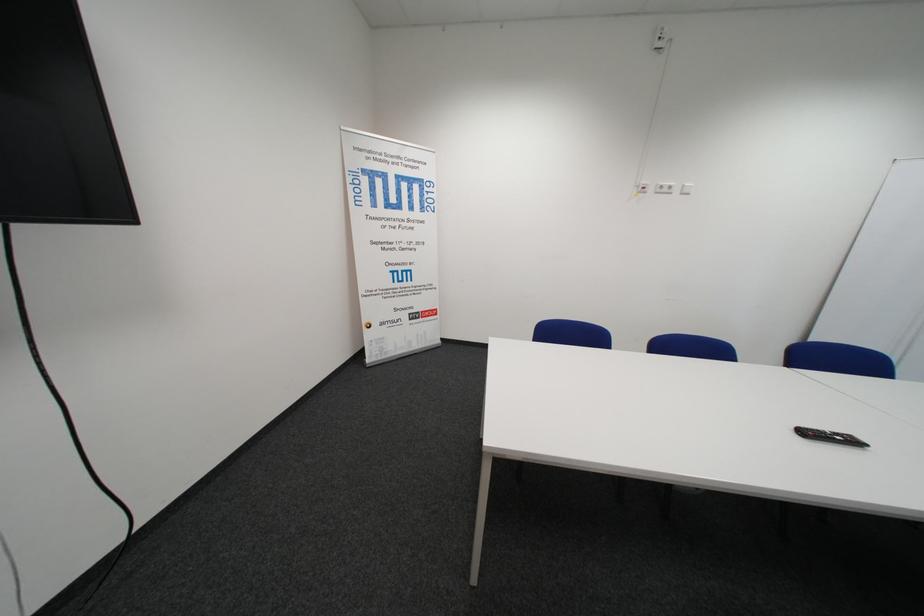
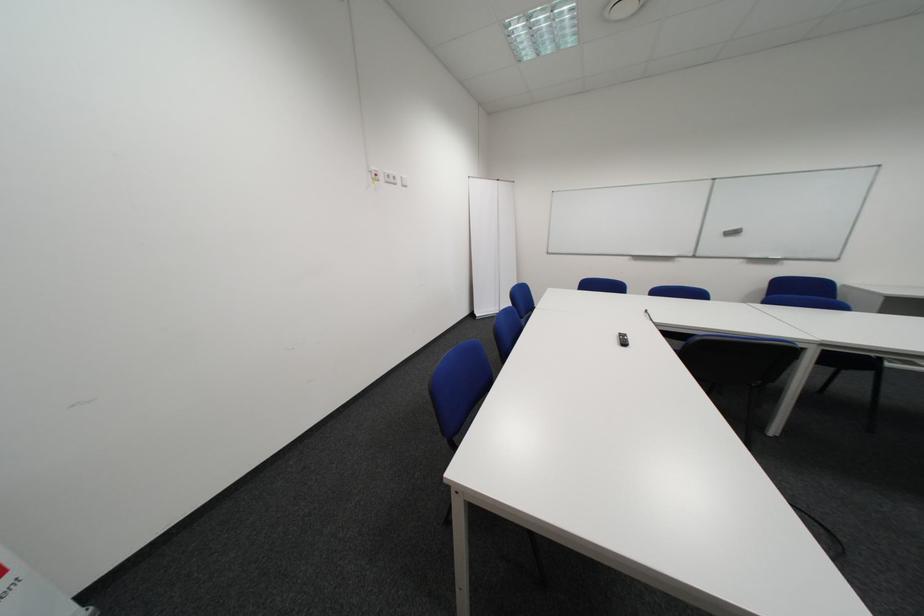
Where in the second image is the point corresponding to point 671,192 from the first image?

(398, 180)